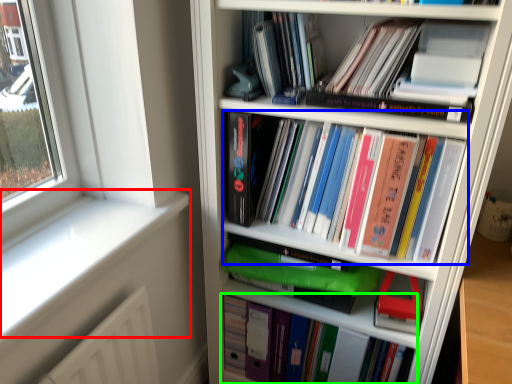
Question: Which object is the closest to the window sill (highlighted by a red box)? Choose among these: book (highlighted by a blue box) or book (highlighted by a green box).

Choices:
 (A) book
 (B) book

Answer: (A)